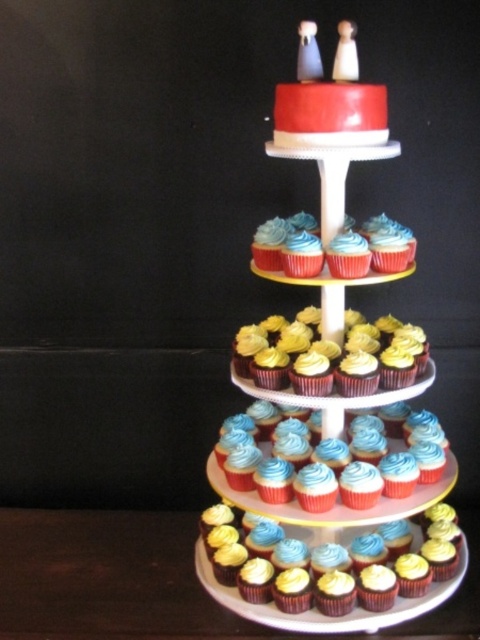
Question: Considering the real-world distances, which object is closest to the smooth chocolate cupcake at lower center?

Choices:
 (A) smooth red cake at upper center
 (B) matte blue frosting cupcake at center

Answer: (B)

Question: Which point appears farthest from the camera in this image?

Choices:
 (A) (311, 529)
 (B) (361, 529)
 (C) (374, 518)

Answer: (A)

Question: Can you confirm if smooth red cake at upper center is smaller than smooth chocolate cupcake at lower center?

Choices:
 (A) no
 (B) yes

Answer: (A)

Question: Estimate the real-world distances between objects in this image. Which object is farther from the matte blue frosting cupcake at center?

Choices:
 (A) smooth chocolate cupcake at lower center
 (B) smooth red cake at upper center

Answer: (A)

Question: Is smooth red cake at upper center thinner than matte blue frosting cupcake at center?

Choices:
 (A) yes
 (B) no

Answer: (B)

Question: Does smooth red cake at upper center appear under smooth chocolate cupcake at lower center?

Choices:
 (A) yes
 (B) no

Answer: (B)